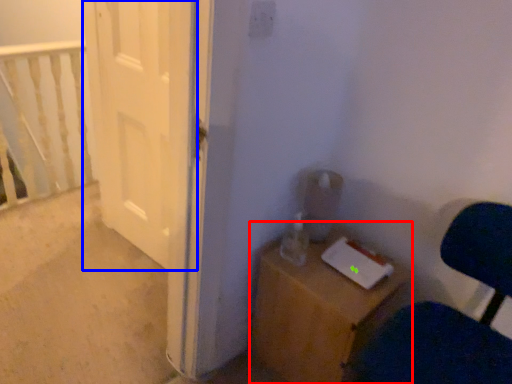
Question: Which object appears closest to the camera in this image, furniture (highlighted by a red box) or door (highlighted by a blue box)?

Choices:
 (A) furniture
 (B) door

Answer: (A)